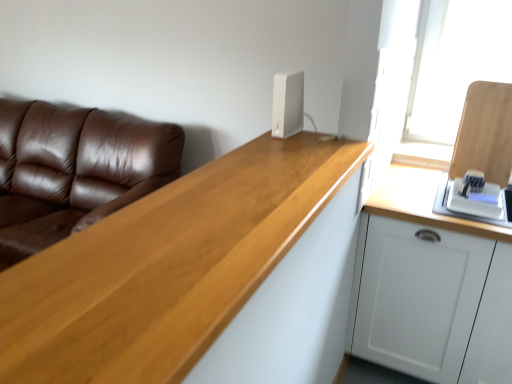
This screenshot has width=512, height=384. I want to click on free space in front of white plastic router at upper center, so click(x=292, y=145).